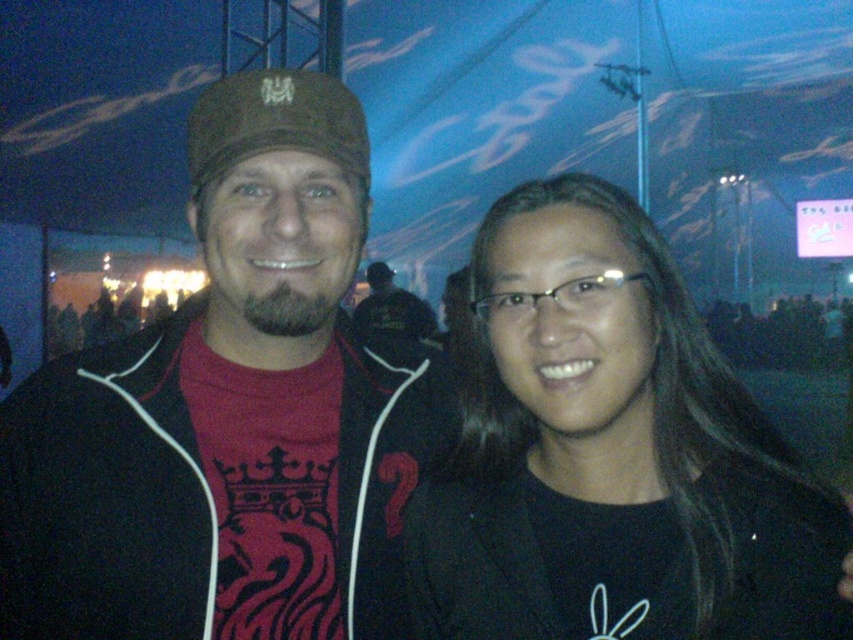
Does point (358, 577) come farther from viewer compared to point (535, 612)?

Yes, point (358, 577) is farther from viewer.

Does point (276, 129) lie in front of point (636, 298)?

That is False.

Locate an element on the screen. This screenshot has height=640, width=853. matte black jacket at center is located at coordinates (229, 413).